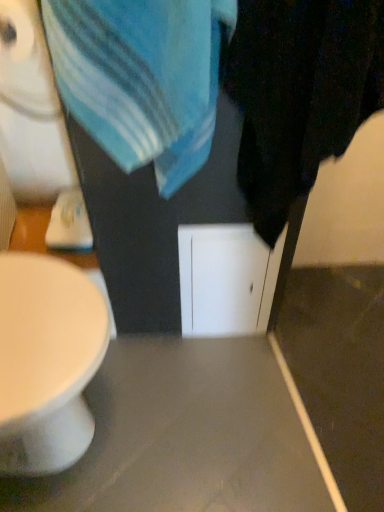
Locate an element on the screen. This screenshot has width=384, height=512. vacant region under black matte towel at right (from a real-world perspective) is located at coordinates (265, 367).